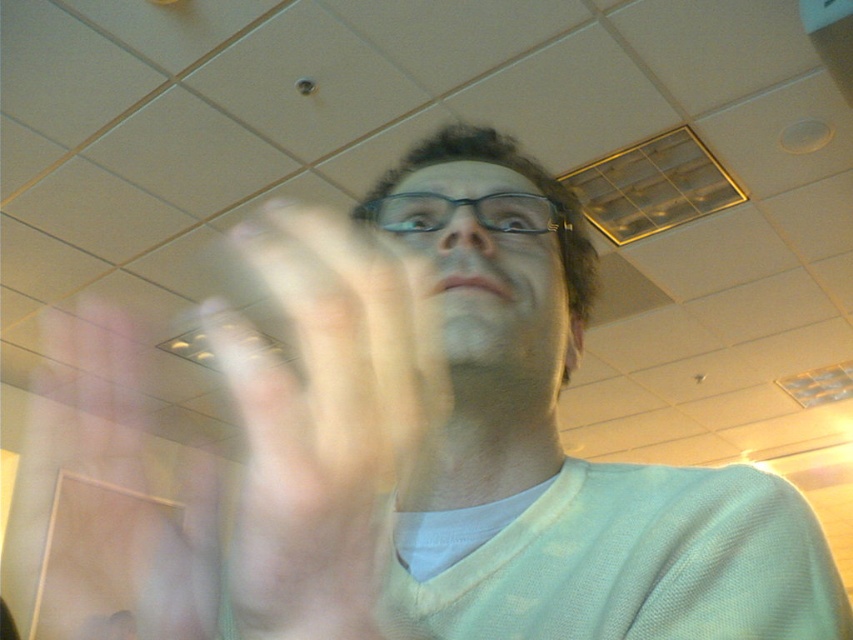
Question: Which object appears farthest from the camera in this image?

Choices:
 (A) translucent flesh at center
 (B) transparent plastic glasses at center
 (C) light green sweater at center
 (D) matte black glasses at center

Answer: (A)

Question: Can you confirm if translucent flesh at center is positioned above transparent plastic glasses at center?

Choices:
 (A) yes
 (B) no

Answer: (B)

Question: Among these objects, which one is nearest to the camera?

Choices:
 (A) matte black glasses at center
 (B) translucent flesh at center
 (C) transparent plastic glasses at center

Answer: (A)

Question: Does translucent flesh at center have a larger size compared to matte black glasses at center?

Choices:
 (A) yes
 (B) no

Answer: (A)

Question: Is light green sweater at center above transparent plastic glasses at center?

Choices:
 (A) no
 (B) yes

Answer: (A)

Question: Among these objects, which one is farthest from the camera?

Choices:
 (A) transparent plastic glasses at center
 (B) matte black glasses at center

Answer: (A)